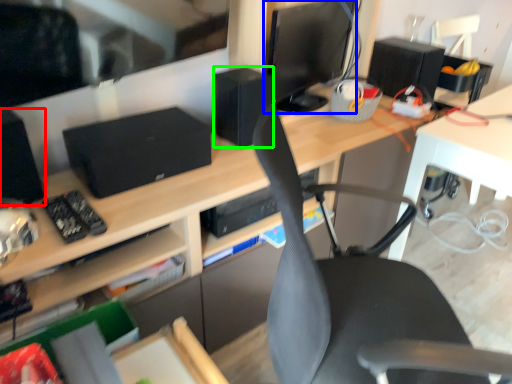
Question: Which object is positioned closest to speaker (highlighted by a red box)? Select from computer monitor (highlighted by a blue box) and speaker (highlighted by a green box).

Choices:
 (A) computer monitor
 (B) speaker

Answer: (B)